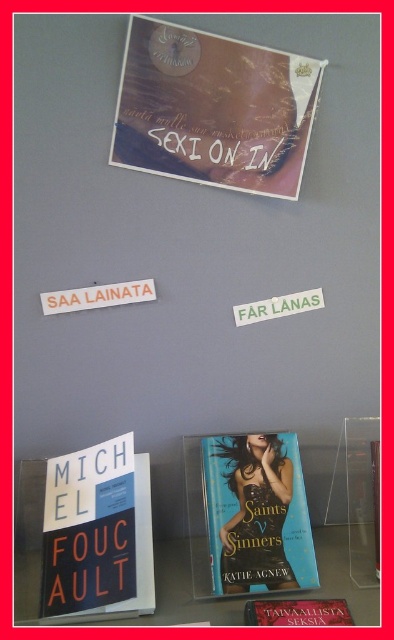
Can you confirm if matte brown book cover at upper center is wider than teal glossy paperback book at center?

Yes.

Who is more forward, (117, 161) or (236, 584)?

Point (236, 584) is more forward.

Identify the location of matte brown book cover at upper center. Image resolution: width=394 pixels, height=640 pixels. (213, 109).

From the picture: Does teal glossy paperback book at center have a greater height compared to blue glossy book at lower center?

Yes.

Between teal glossy paperback book at center and blue glossy book at lower center, which one is positioned lower?

blue glossy book at lower center

Who is more distant from viewer, (x=213, y=577) or (x=334, y=616)?

The point (x=213, y=577) is behind.

This screenshot has height=640, width=394. In order to click on teal glossy paperback book at center in this screenshot , I will do `click(247, 515)`.

Is the position of matte brown book cover at upper center more distant than that of blue glossy book at lower center?

Yes, it is behind blue glossy book at lower center.

Who is more forward, (189,145) or (317,598)?

Point (317,598)

You are a GUI agent. You are given a task and a screenshot of the screen. Output one action in this format:
    pyautogui.click(x=<x>, y=<y>)
    Task: Click on the matte brown book cover at upper center
    
    Given the screenshot: What is the action you would take?
    pyautogui.click(x=213, y=109)